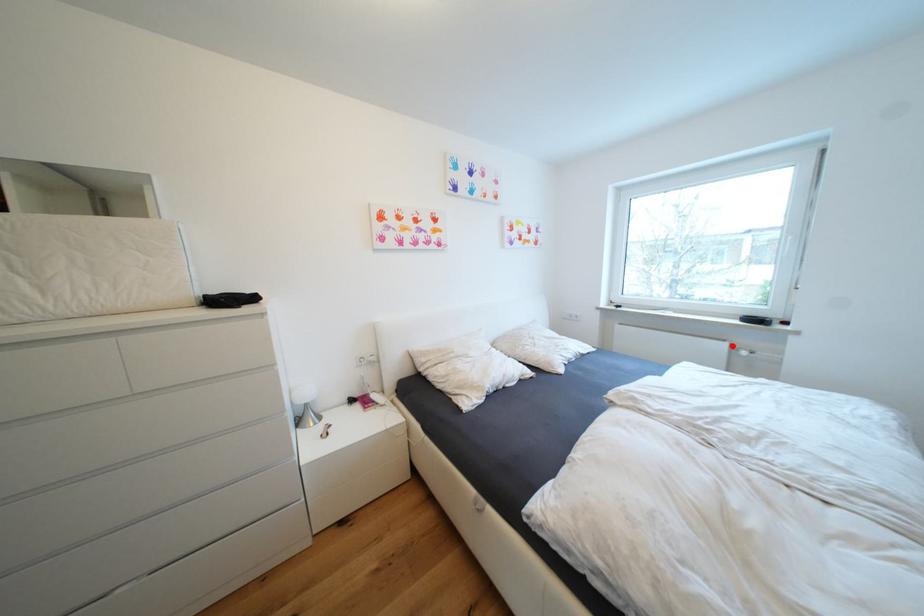
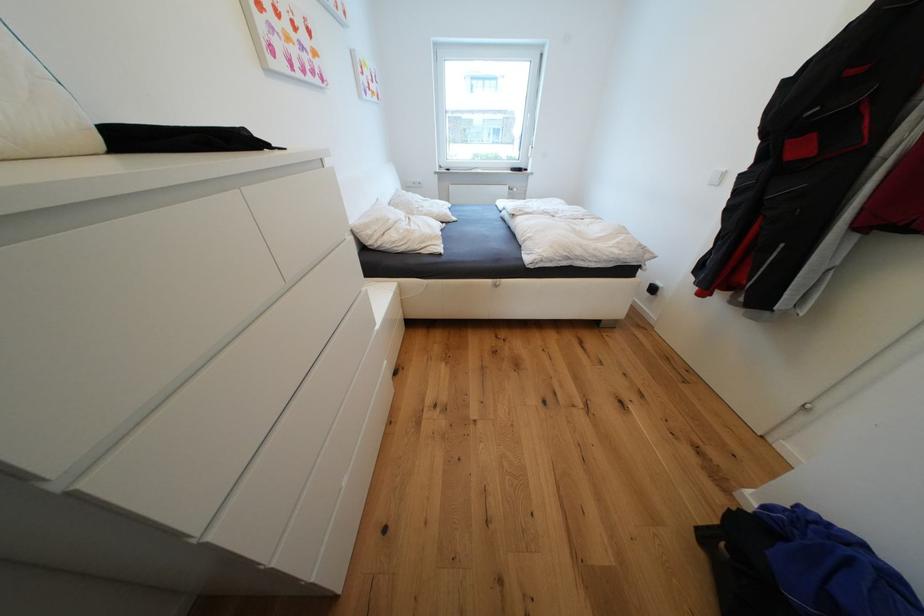
Question: A red point is marked in image1. In image2, is the corresponding 3D point closer to the camera or farther? Reply with the corresponding letter.

Choices:
 (A) The corresponding 3D point is closer.
 (B) The corresponding 3D point is farther.

Answer: (A)